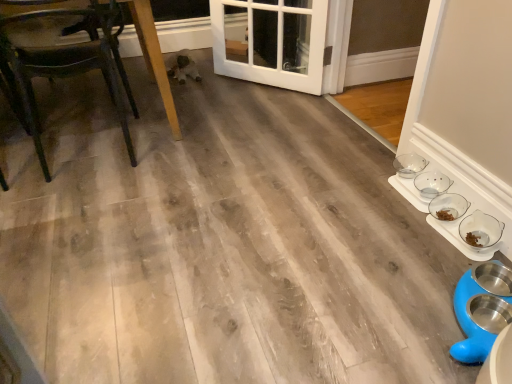
Describe the element at coordinates (272, 42) in the screenshot. The image size is (512, 384). I see `white glossy door at center` at that location.

Where is `clear glass bowls at lower right, which is counted as the 2th bowl, starting from the front`? This screenshot has width=512, height=384. clear glass bowls at lower right, which is counted as the 2th bowl, starting from the front is located at coordinates (431, 184).

Measure the distance between point (436,181) and camera.

1.73 meters.

Find the location of a particular element. wooden chair at left is located at coordinates tap(71, 67).

From the image's perspective, which is below, clear glass bowls at lower right, acting as the 2th bowl starting from the back, or clear glass bowl at lower right, which is the first bowl from front to back?

From the image's view, clear glass bowl at lower right, which is the first bowl from front to back, is below.

How far apart are clear glass bowls at lower right, acting as the 2th bowl starting from the back, and clear glass bowl at lower right, which is the first bowl from front to back?

clear glass bowls at lower right, acting as the 2th bowl starting from the back, and clear glass bowl at lower right, which is the first bowl from front to back, are 8.13 centimeters apart from each other.

The width and height of the screenshot is (512, 384). Find the location of `the 1st bowl behind the clear glass bowl at lower right, the 3th bowl in the back-to-front sequence`. the 1st bowl behind the clear glass bowl at lower right, the 3th bowl in the back-to-front sequence is located at coordinates (431, 184).

Is clear glass bowls at right, which ranks as the third bowl in front-to-back order, completely or partially outside of clear glass bowl at lower right, which is the first bowl from front to back?

Yes, clear glass bowls at right, which ranks as the third bowl in front-to-back order, is located beyond the bounds of clear glass bowl at lower right, which is the first bowl from front to back.

Is clear glass bowls at right, which is counted as the 1th bowl, starting from the back, placed right next to clear glass bowl at lower right, the 3th bowl in the back-to-front sequence?

No, clear glass bowls at right, which is counted as the 1th bowl, starting from the back, is not beside clear glass bowl at lower right, the 3th bowl in the back-to-front sequence.

Between point (415, 166) and point (457, 211), which one is positioned in front?

The point (457, 211) is closer to the camera.

Does clear glass bowls at right, which is counted as the 1th bowl, starting from the back, have a lesser width compared to white glossy door at center?

Yes.

Who is more distant, clear glass bowls at right, which is counted as the 1th bowl, starting from the back, or white glossy door at center?

white glossy door at center is behind.

The width and height of the screenshot is (512, 384). I want to click on door above the clear glass bowls at right, which is counted as the 1th bowl, starting from the back (from the image's perspective), so click(272, 42).

Considering the positions of objects wooden chair at left and white glossy door at center in the image provided, who is more to the left, wooden chair at left or white glossy door at center?

wooden chair at left.

In order to click on chair that is below the white glossy door at center (from the image's perspective) in this screenshot , I will do `click(71, 67)`.

Is wooden chair at left situated inside white glossy door at center or outside?

wooden chair at left is outside white glossy door at center.

Which object is further away from the camera taking this photo, wooden chair at left or white glossy door at center?

Positioned behind is white glossy door at center.

Identify the location of the 1st bowl below the white glossy door at center (from the image's perspective). (409, 165).

Considering the sizes of objects white glossy door at center and clear glass bowls at right, which is counted as the 1th bowl, starting from the back, in the image provided, who is smaller, white glossy door at center or clear glass bowls at right, which is counted as the 1th bowl, starting from the back,?

clear glass bowls at right, which is counted as the 1th bowl, starting from the back, is smaller.

Considering the positions of objects white glossy door at center and clear glass bowls at right, which ranks as the third bowl in front-to-back order, in the image provided, who is more to the right, white glossy door at center or clear glass bowls at right, which ranks as the third bowl in front-to-back order,?

From the viewer's perspective, clear glass bowls at right, which ranks as the third bowl in front-to-back order, appears more on the right side.

Is white glossy door at center far from clear glass bowls at right, which is counted as the 1th bowl, starting from the back?

Yes, white glossy door at center is far from clear glass bowls at right, which is counted as the 1th bowl, starting from the back.

This screenshot has width=512, height=384. I want to click on the 1st bowl below the wooden chair at left (from a real-world perspective), so (409, 165).

Is wooden chair at left taller or shorter than clear glass bowls at right, which ranks as the third bowl in front-to-back order?

Clearly, wooden chair at left is taller compared to clear glass bowls at right, which ranks as the third bowl in front-to-back order.

Is wooden chair at left not close to clear glass bowls at right, which ranks as the third bowl in front-to-back order?

wooden chair at left is positioned a significant distance from clear glass bowls at right, which ranks as the third bowl in front-to-back order.

Which of these two, clear glass bowls at right, which ranks as the third bowl in front-to-back order, or wooden chair at left, stands taller?

With more height is wooden chair at left.

Looking at their sizes, would you say clear glass bowls at right, which ranks as the third bowl in front-to-back order, is wider or thinner than wooden chair at left?

Clearly, clear glass bowls at right, which ranks as the third bowl in front-to-back order, has less width compared to wooden chair at left.

Choose the correct answer: Is clear glass bowls at right, which ranks as the third bowl in front-to-back order, inside wooden chair at left or outside it?

clear glass bowls at right, which ranks as the third bowl in front-to-back order, exists outside the volume of wooden chair at left.

Is clear glass bowls at right, which is counted as the 1th bowl, starting from the back, in contact with wooden chair at left?

No, clear glass bowls at right, which is counted as the 1th bowl, starting from the back, is not beside wooden chair at left.

You are a GUI agent. You are given a task and a screenshot of the screen. Output one action in this format:
    pyautogui.click(x=<x>, y=<y>)
    Task: Click on the bowl below the clear glass bowls at lower right, acting as the 2th bowl starting from the back (from the image's perspective)
    
    Given the screenshot: What is the action you would take?
    pyautogui.click(x=448, y=207)

Starting from the clear glass bowls at right, which is counted as the 1th bowl, starting from the back, which bowl is the 2nd one in front? Please provide its 2D coordinates.

[(448, 207)]

From the image, which object appears to be nearer to white glossy door at center, clear glass bowls at lower right, which is counted as the 2th bowl, starting from the front, or wooden chair at left?

The object closer to white glossy door at center is wooden chair at left.

Considering their positions, is white glossy door at center positioned further to clear glass bowl at lower right, the 3th bowl in the back-to-front sequence, than clear glass bowls at lower right, which is counted as the 2th bowl, starting from the front?

white glossy door at center.

Consider the image. Looking at the image, which one is located closer to clear glass bowls at lower right, acting as the 2th bowl starting from the back, wooden chair at left or clear glass bowls at right, which is counted as the 1th bowl, starting from the back?

clear glass bowls at right, which is counted as the 1th bowl, starting from the back, lies closer to clear glass bowls at lower right, acting as the 2th bowl starting from the back, than the other object.

Considering their positions, is wooden chair at left positioned closer to white glossy door at center than clear glass bowl at lower right, which is the first bowl from front to back?

The object closer to white glossy door at center is wooden chair at left.

Looking at the image, which one is located further to wooden chair at left, white glossy door at center or clear glass bowl at lower right, which is the first bowl from front to back?

Based on the image, clear glass bowl at lower right, which is the first bowl from front to back, appears to be further to wooden chair at left.

Considering their positions, is white glossy door at center positioned further to clear glass bowls at right, which ranks as the third bowl in front-to-back order, than clear glass bowl at lower right, which is the first bowl from front to back?

Among the two, white glossy door at center is located further to clear glass bowls at right, which ranks as the third bowl in front-to-back order.

Considering their positions, is clear glass bowls at right, which is counted as the 1th bowl, starting from the back, positioned closer to clear glass bowls at lower right, acting as the 2th bowl starting from the back, than wooden chair at left?

clear glass bowls at right, which is counted as the 1th bowl, starting from the back.

Based on their spatial positions, is clear glass bowl at lower right, the 3th bowl in the back-to-front sequence, or white glossy door at center closer to clear glass bowls at right, which is counted as the 1th bowl, starting from the back?

Based on the image, clear glass bowl at lower right, the 3th bowl in the back-to-front sequence, appears to be nearer to clear glass bowls at right, which is counted as the 1th bowl, starting from the back.

At what (x,y) coordinates should I click in order to perform the action: click on door located between wooden chair at left and clear glass bowl at lower right, the 3th bowl in the back-to-front sequence, in the left-right direction. Please return your answer as a coordinate pair (x, y). The width and height of the screenshot is (512, 384). Looking at the image, I should click on (272, 42).

Identify the location of door between wooden chair at left and clear glass bowls at right, which ranks as the third bowl in front-to-back order. (272, 42).

Locate an element on the screen. The height and width of the screenshot is (384, 512). bowl between wooden chair at left and clear glass bowls at lower right, which is counted as the 2th bowl, starting from the front, in the horizontal direction is located at coordinates (409, 165).

Find the location of a particular element. The image size is (512, 384). bowl between clear glass bowl at lower right, which is the first bowl from front to back, and clear glass bowls at right, which is counted as the 1th bowl, starting from the back, from front to back is located at coordinates (431, 184).